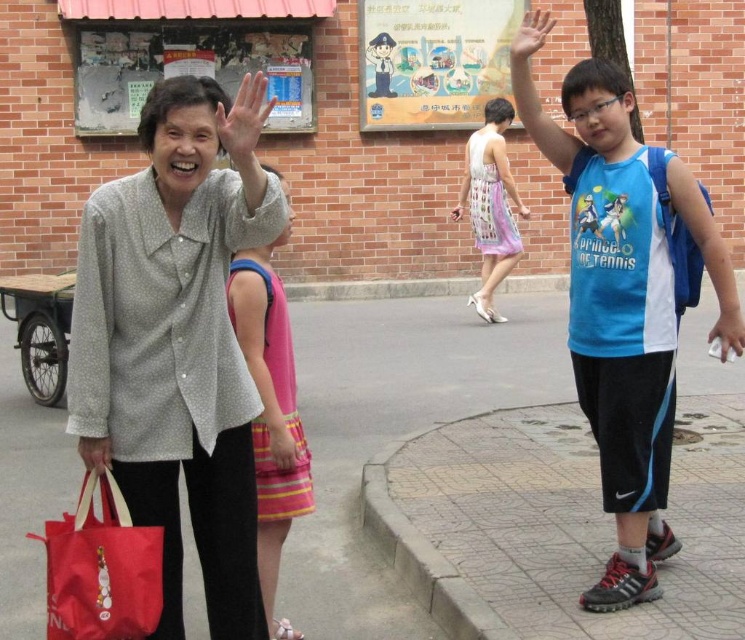
Question: In this image, where is scratched paperboard at upper left located relative to pink striped dress at center?

Choices:
 (A) right
 (B) left

Answer: (B)

Question: Which point is farther from the camera taking this photo?

Choices:
 (A) (226, 150)
 (B) (510, 248)
 (C) (624, 600)
 (D) (256, 554)

Answer: (B)

Question: Which point is farther to the camera?

Choices:
 (A) (221, 129)
 (B) (519, 241)
 (C) (95, 586)
 (D) (98, 467)

Answer: (B)

Question: Considering the real-world distances, which object is closest to the red fabric bag at lower left?

Choices:
 (A) blue fabric shirt at center
 (B) matte gray blouse at center
 (C) scratched paperboard at upper left

Answer: (B)

Question: In this image, where is pink striped dress at center located relative to pastel floral dress at center?

Choices:
 (A) above
 (B) below

Answer: (B)

Question: Is matte gray blouse at center thinner than pastel floral dress at center?

Choices:
 (A) no
 (B) yes

Answer: (B)